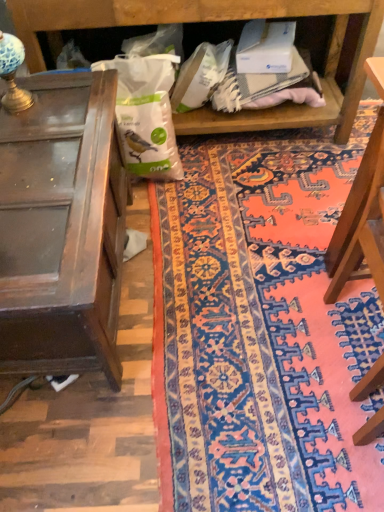
In order to click on free area in between wooden table at left and white matte paper bag at center in this screenshot , I will do `click(162, 245)`.